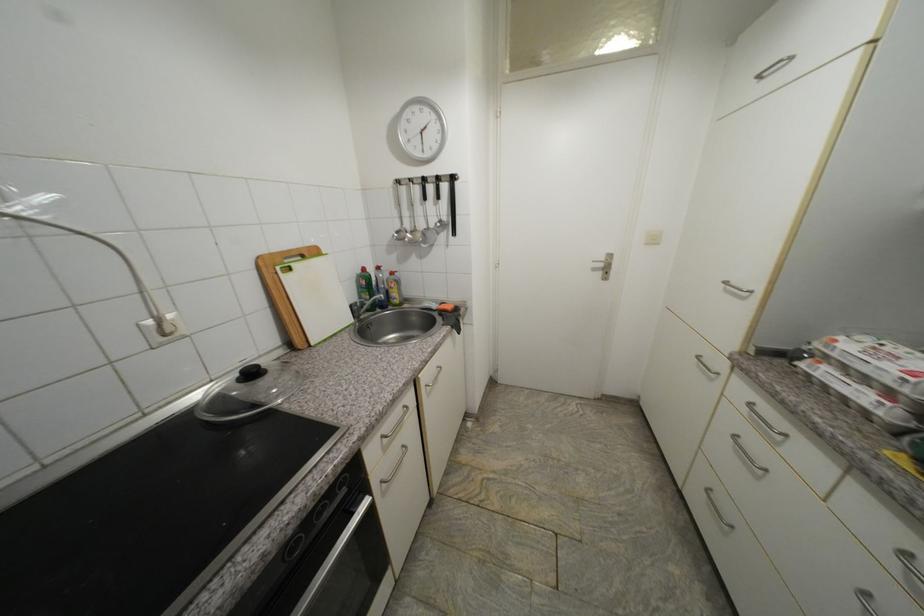
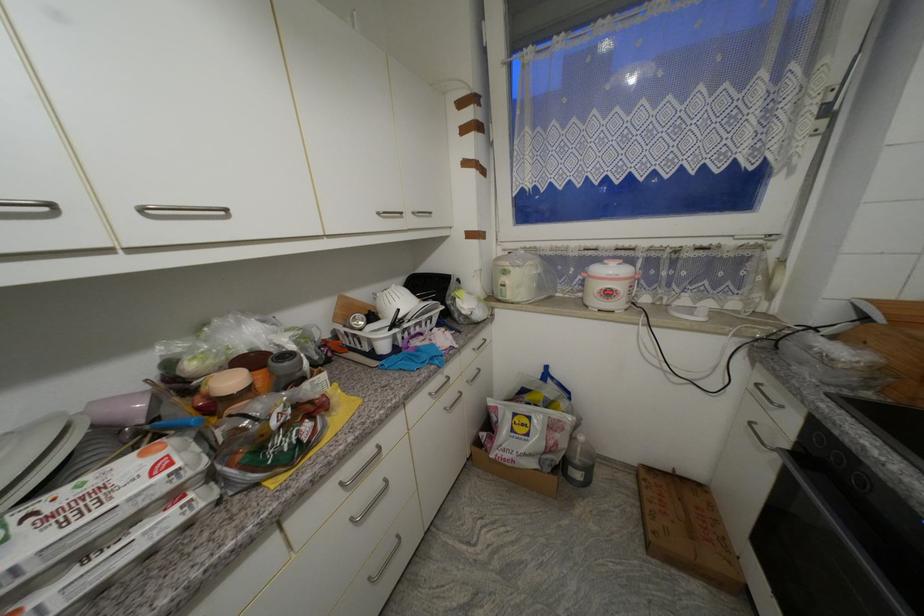
Locate, in the second image, the point that corresponds to (x=894, y=395) in the first image.

(178, 498)